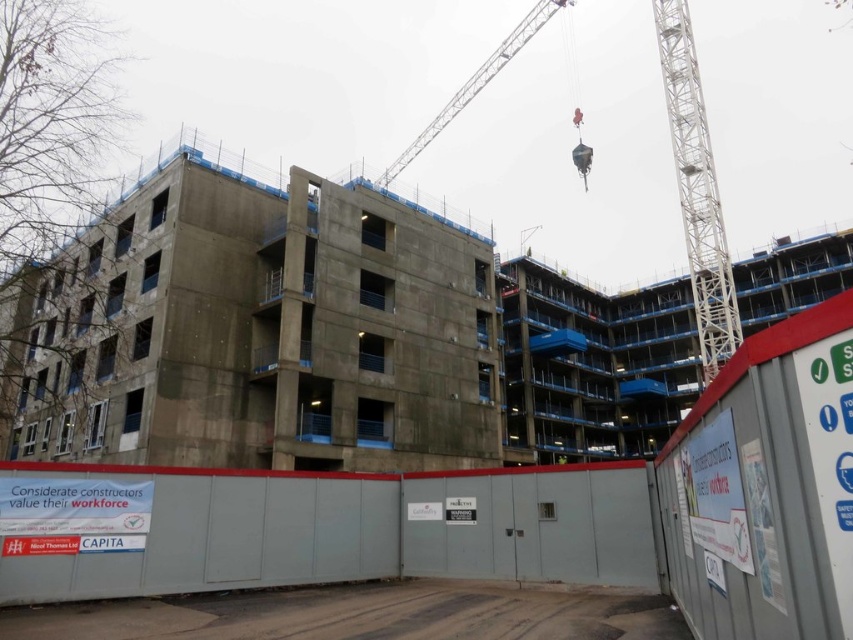
Can you confirm if white metallic crane at upper center is taller than metallic silver crane at upper center?

Correct, white metallic crane at upper center is much taller as metallic silver crane at upper center.

Is white metallic crane at upper center below metallic silver crane at upper center?

Indeed, white metallic crane at upper center is positioned under metallic silver crane at upper center.

Which is behind, point (558, 3) or point (515, 42)?

Positioned behind is point (515, 42).

Find the location of a particular element. Image resolution: width=853 pixels, height=640 pixels. white metallic crane at upper center is located at coordinates (695, 188).

Is white metallic crane at upper center wider than white metallic crane at upper right?

Correct, the width of white metallic crane at upper center exceeds that of white metallic crane at upper right.

Between point (381, 179) and point (712, 285), which one is positioned behind?

The point (381, 179) is behind.

Which is behind, point (717, 272) or point (711, 224)?

Point (717, 272)

You are a GUI agent. You are given a task and a screenshot of the screen. Output one action in this format:
    pyautogui.click(x=<x>, y=<y>)
    Task: Click on the white metallic crane at upper center
    
    Given the screenshot: What is the action you would take?
    point(695,188)

Can you confirm if white metallic crane at upper right is thinner than metallic silver crane at upper center?

Indeed, white metallic crane at upper right has a lesser width compared to metallic silver crane at upper center.

Who is higher up, white metallic crane at upper right or metallic silver crane at upper center?

metallic silver crane at upper center is above.

Does point (718, 310) come behind point (506, 51)?

That is False.

You are a GUI agent. You are given a task and a screenshot of the screen. Output one action in this format:
    pyautogui.click(x=<x>, y=<y>)
    Task: Click on the white metallic crane at upper right
    This screenshot has width=853, height=640.
    Given the screenshot: What is the action you would take?
    pyautogui.click(x=695, y=188)